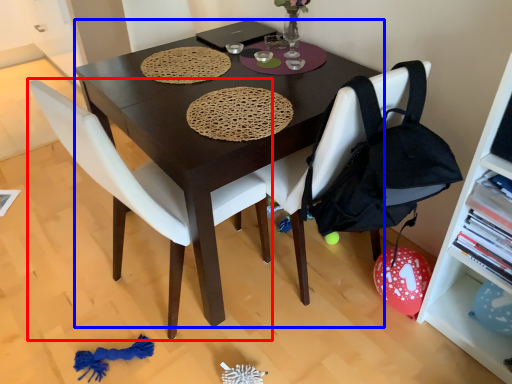
Question: Which object appears closest to the camera in this image, chair (highlighted by a red box) or desk (highlighted by a blue box)?

Choices:
 (A) chair
 (B) desk

Answer: (A)